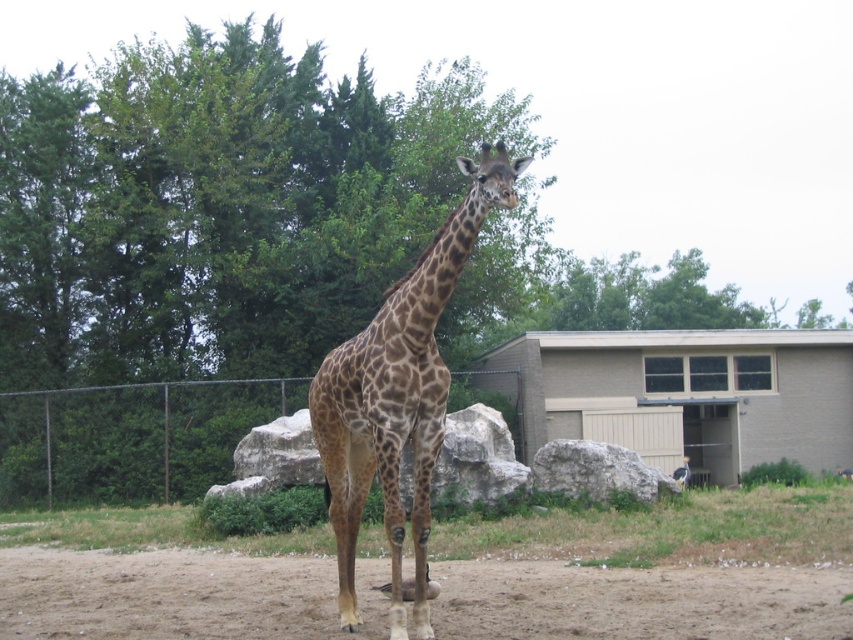
Can you confirm if brown sandy dirt at lower center is positioned to the left of gray rough rock at center?

Incorrect, brown sandy dirt at lower center is not on the left side of gray rough rock at center.

Which of these two, brown sandy dirt at lower center or gray rough rock at center, stands taller?

Standing taller between the two is gray rough rock at center.

Who is more distant from viewer, (303, 570) or (596, 452)?

The point (596, 452) is behind.

This screenshot has width=853, height=640. In order to click on brown sandy dirt at lower center in this screenshot , I will do `click(177, 595)`.

Does point (401, 291) lie behind point (596, 472)?

That is False.

Does spotted fur giraffe at center have a greater height compared to gray rough rock at center?

Correct, spotted fur giraffe at center is much taller as gray rough rock at center.

What do you see at coordinates (398, 397) in the screenshot?
I see `spotted fur giraffe at center` at bounding box center [398, 397].

Locate an element on the screen. The width and height of the screenshot is (853, 640). spotted fur giraffe at center is located at coordinates pos(398,397).

Can you confirm if brown sandy dirt at lower center is smaller than metallic chain-link fence at center?

Indeed, brown sandy dirt at lower center has a smaller size compared to metallic chain-link fence at center.

Can you confirm if brown sandy dirt at lower center is positioned below metallic chain-link fence at center?

Incorrect, brown sandy dirt at lower center is not positioned below metallic chain-link fence at center.

Who is more forward, (x=724, y=582) or (x=99, y=492)?

Point (x=724, y=582)

Locate an element on the screen. This screenshot has width=853, height=640. brown sandy dirt at lower center is located at coordinates (177, 595).